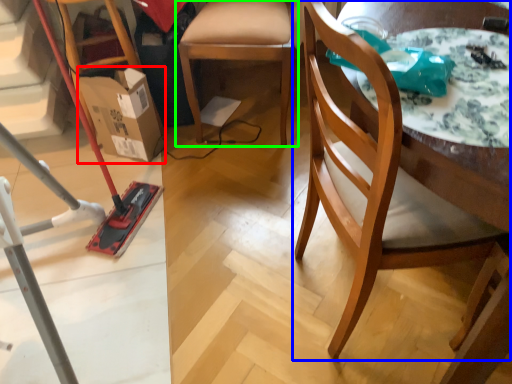
Question: Which is nearer to the cardboard box (highlighted by a red box)? chair (highlighted by a blue box) or chair (highlighted by a green box).

Choices:
 (A) chair
 (B) chair

Answer: (B)